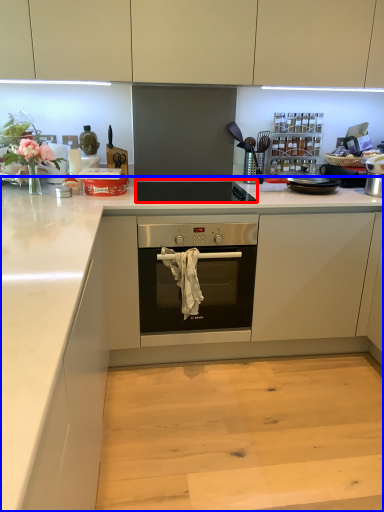
Question: Which of the following is the closest to the observer, gas stove (highlighted by a red box) or countertop (highlighted by a blue box)?

Choices:
 (A) gas stove
 (B) countertop

Answer: (B)